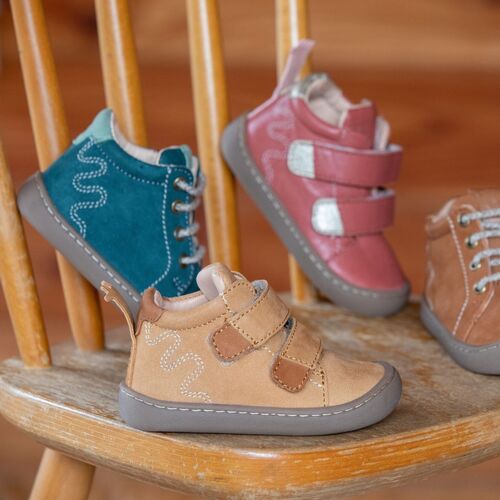
Where is `decorative stitching`? decorative stitching is located at coordinates (190, 355), (100, 174), (271, 127), (428, 274).